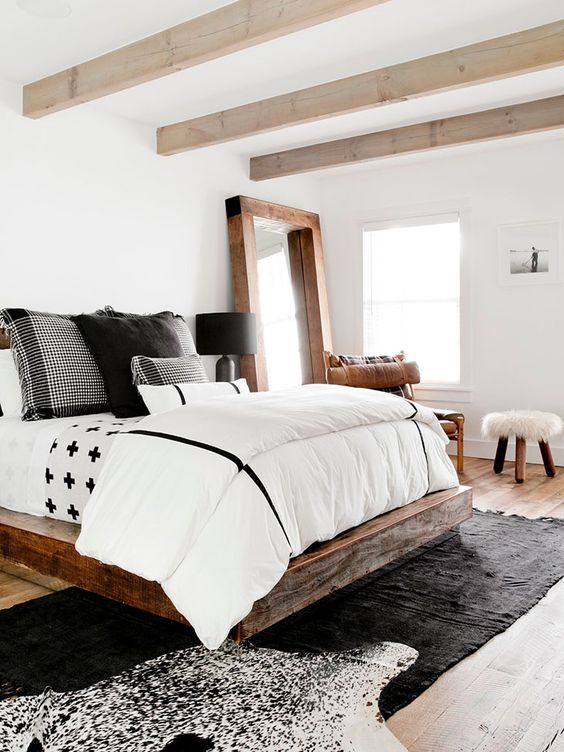
Locate an element on the screen. grid pillow is located at coordinates (55, 353).